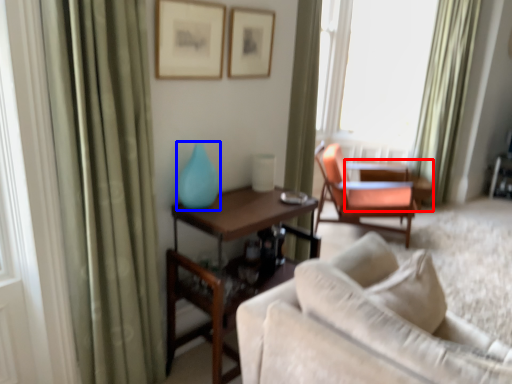
Question: Which point is further to the camera, table (highlighted by a red box) or turquoise (highlighted by a blue box)?

Choices:
 (A) table
 (B) turquoise

Answer: (A)